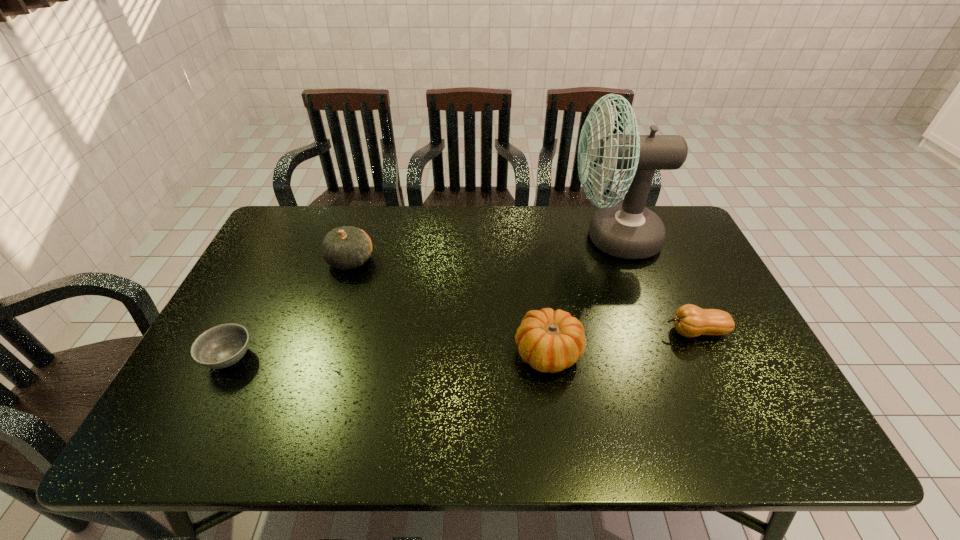
At what (x,y) coordinates should I click in order to perform the action: click on free point between the shortest object and the third object from left to right. Please return your answer as a coordinate pair (x, y). The image size is (960, 540). Looking at the image, I should click on tap(389, 355).

At what (x,y) coordinates should I click in order to perform the action: click on free space between the farthest gourd and the shortest object. Please return your answer as a coordinate pair (x, y). Looking at the image, I should click on (290, 309).

At what (x,y) coordinates should I click in order to perform the action: click on vacant space that's between the tallest object and the farthest gourd. Please return your answer as a coordinate pair (x, y). This screenshot has height=540, width=960. Looking at the image, I should click on (482, 249).

The image size is (960, 540). What are the coordinates of `blank region between the tallest object and the second shortest object` in the screenshot? It's located at (655, 285).

What are the coordinates of `blank region between the rightmost gourd and the leftmost object` in the screenshot? It's located at (463, 345).

You are a GUI agent. You are given a task and a screenshot of the screen. Output one action in this format:
    pyautogui.click(x=<x>, y=<y>)
    Task: Click on the blank region between the tallest object and the rightmost gourd
    
    Given the screenshot: What is the action you would take?
    pyautogui.click(x=655, y=285)

At what (x,y) coordinates should I click in order to perform the action: click on free space between the second shortest object and the leftmost gourd. Please return your answer as a coordinate pair (x, y). The width and height of the screenshot is (960, 540). Looking at the image, I should click on (523, 296).

The height and width of the screenshot is (540, 960). Find the location of `unoccupied position between the leftmost object and the third object from right to left`. unoccupied position between the leftmost object and the third object from right to left is located at coordinates (389, 355).

Where is `object that is the closest to the second gourd from right to left`? object that is the closest to the second gourd from right to left is located at coordinates (689, 320).

Choose which object is the third nearest neighbor to the second gourd from left to right. Please provide its 2D coordinates. Your answer should be formatted as a tuple, i.e. [(x, y)], where the tuple contains the x and y coordinates of a point satisfying the conditions above.

[(347, 247)]